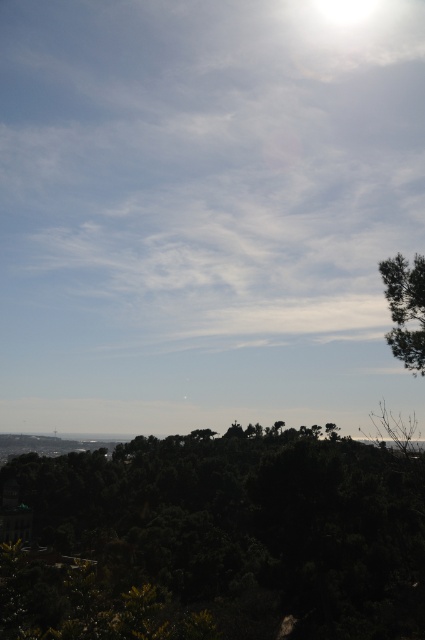
In the scene shown: You are standing in the middle of a forest and see the dark green leafy tree at center and the green leafy tree at upper right. Which tree is closer to the ground?

The dark green leafy tree at center is closer to the ground because it is positioned below the green leafy tree at upper right.

You are standing at the center of the image and want to walk towards the dark green leafy tree at center. In which direction should you move?

The dark green leafy tree at center is located at point 0.838 on the x axis and 0.532 on the y axis. Since you are at the center, which is point 0.5 on both axes, you should move towards the right and slightly downward to reach it.